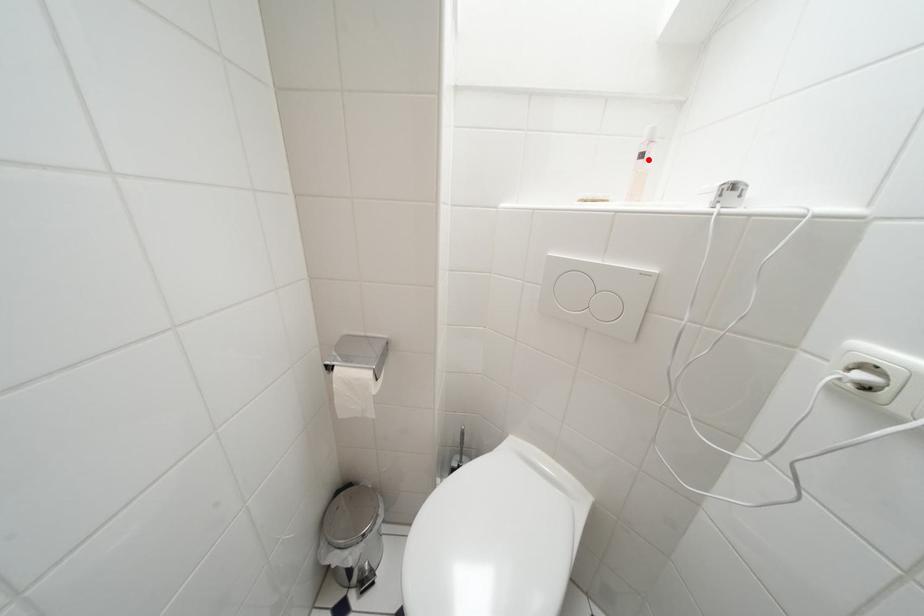
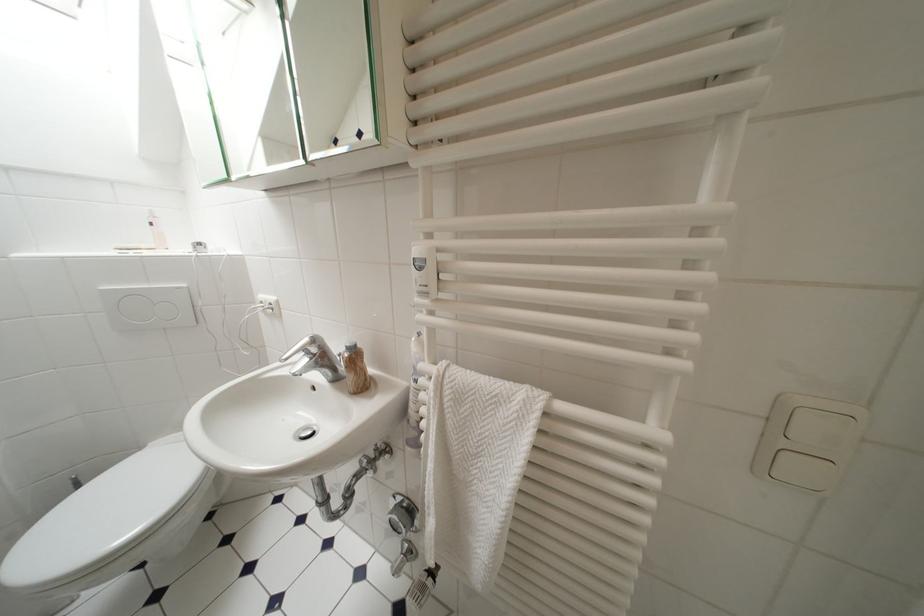
Where in the second image is the point corresponding to the highlighted location from the first image?

(159, 227)